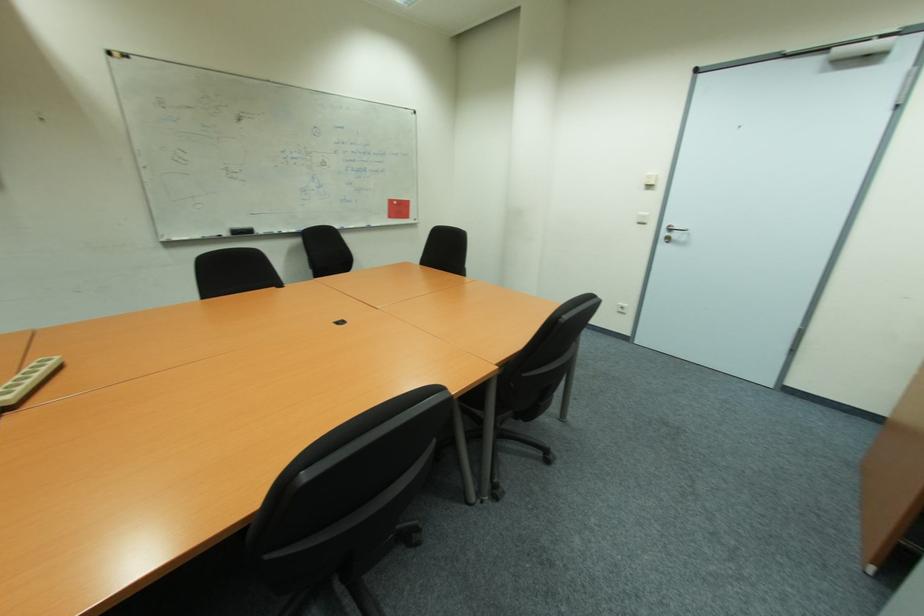
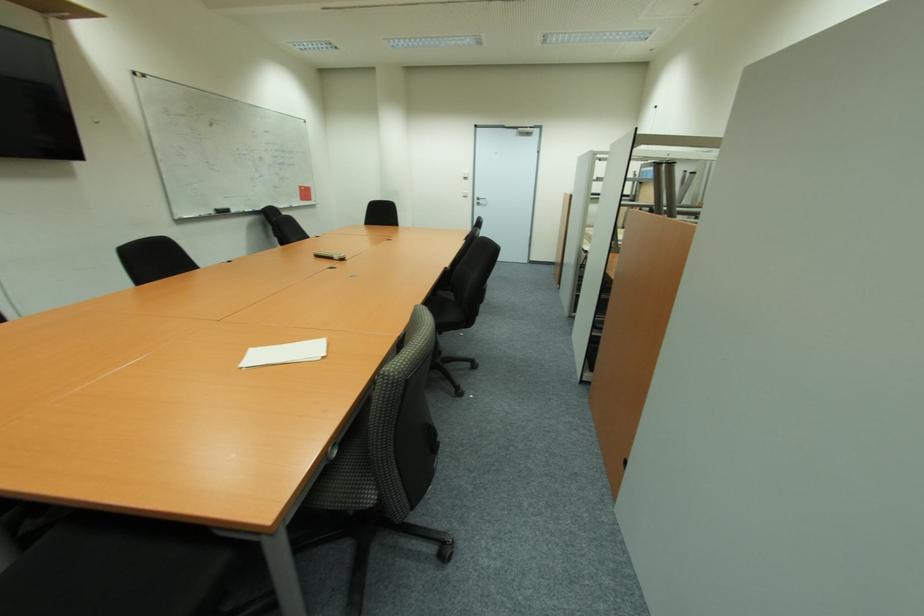
The point at [647,187] is marked in the first image. Where is the corresponding point in the second image?

(467, 179)